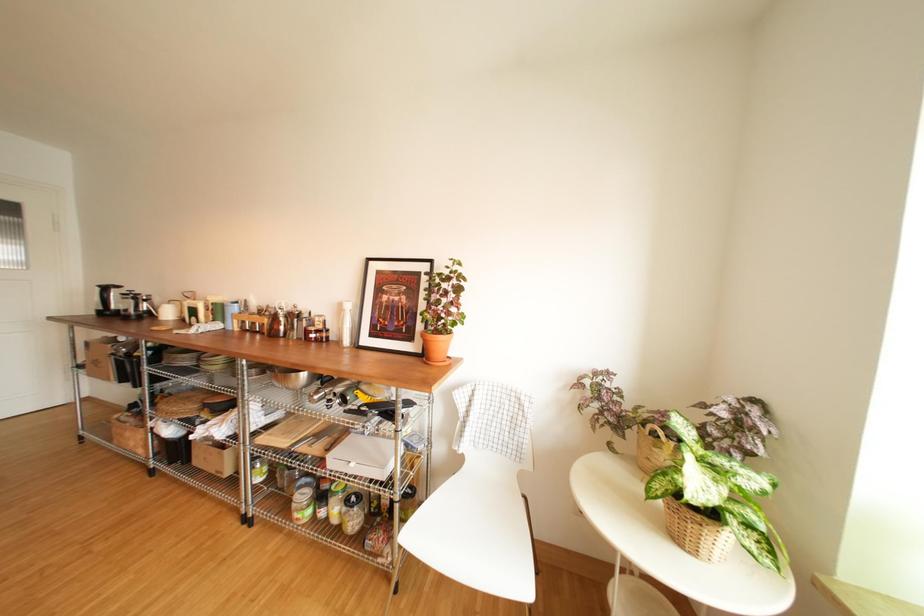
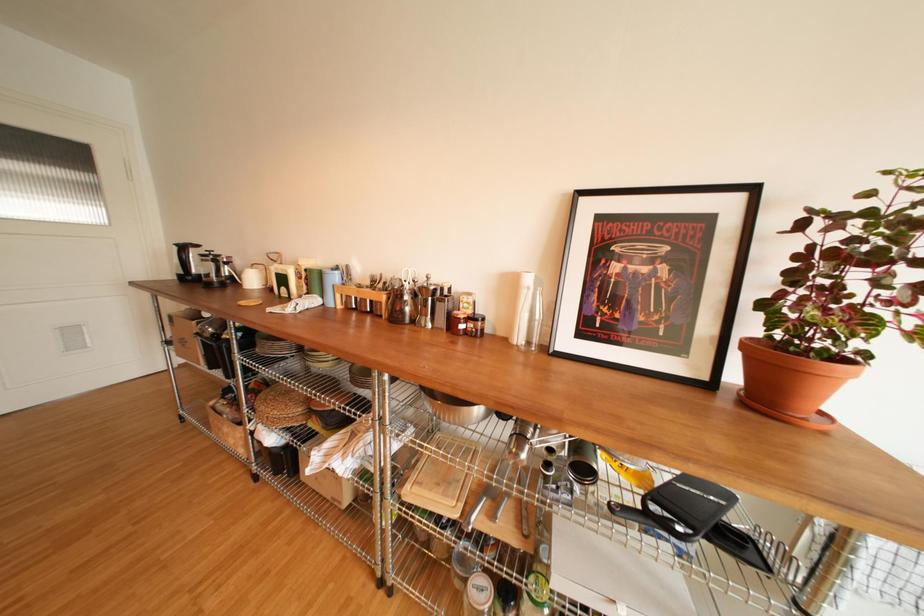
Question: The camera is either moving clockwise (left) or counter-clockwise (right) around the object. The first image is from the beginning of the video and the second image is from the end. Is the camera moving left or right when shooting the video?

Choices:
 (A) Left
 (B) Right

Answer: (B)